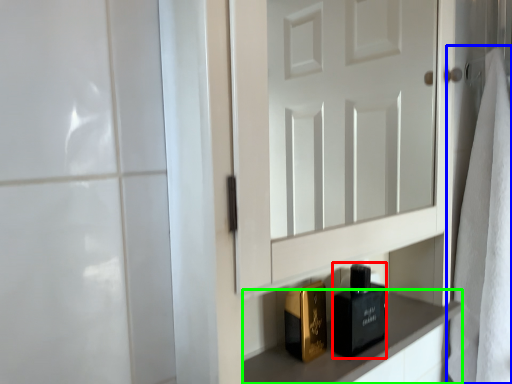
Question: Based on their relative distances, which object is farther from perfume (highlighted by a red box)? Choose from bath towel (highlighted by a blue box) and cabinetry (highlighted by a green box).

Choices:
 (A) bath towel
 (B) cabinetry

Answer: (A)